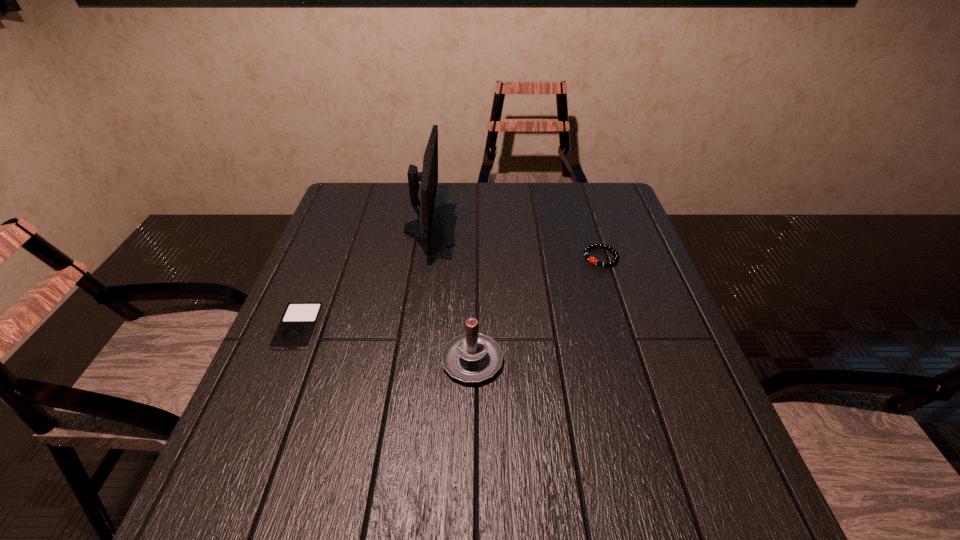
I want to click on the tallest object, so click(434, 230).

Locate an element on the screen. This screenshot has width=960, height=540. candle is located at coordinates (472, 357).

Where is `bracelet`? Image resolution: width=960 pixels, height=540 pixels. bracelet is located at coordinates (586, 250).

Locate an element on the screen. the rightmost object is located at coordinates (586, 250).

I want to click on the shortest object, so click(x=296, y=329).

In order to click on iPod in this screenshot , I will do `click(296, 329)`.

Identify the location of free space located on the screen side of the monitor. This screenshot has height=540, width=960. (500, 230).

In order to click on vacant space located 0.110m on the side of the third shortest object with the handle loop in this screenshot , I will do `click(473, 299)`.

Locate an element on the screen. This screenshot has height=540, width=960. vacant space located on the side of the third shortest object with the handle loop is located at coordinates (474, 255).

In order to click on vacant space located 0.100m on the side of the third shortest object with the handle loop in this screenshot , I will do click(x=473, y=301).